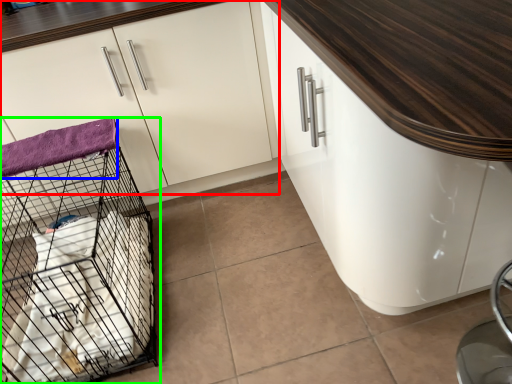
Question: Which object is positioned closest to cabinetry (highlighted by a red box)? Select from blanket (highlighted by a blue box) and bird cage (highlighted by a green box).

Choices:
 (A) blanket
 (B) bird cage

Answer: (A)